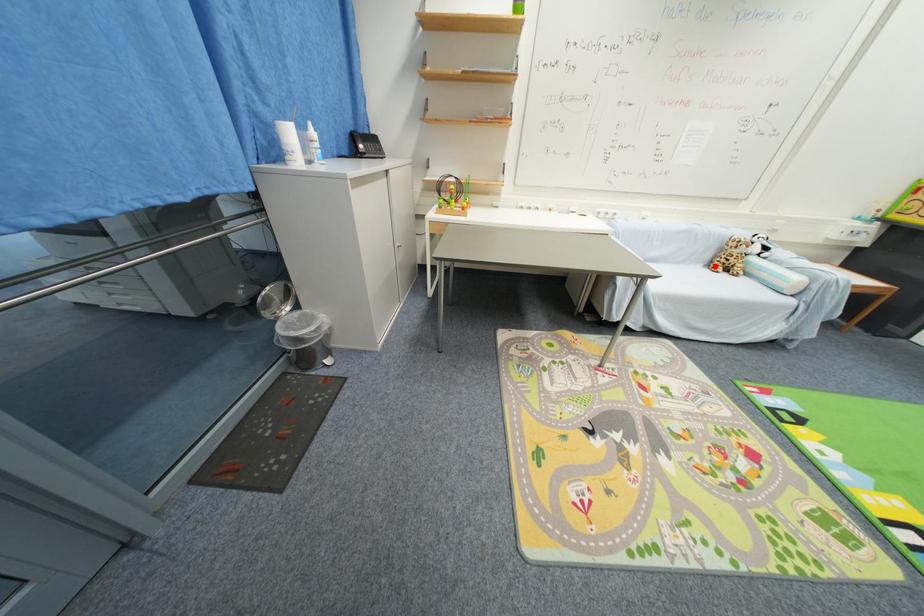
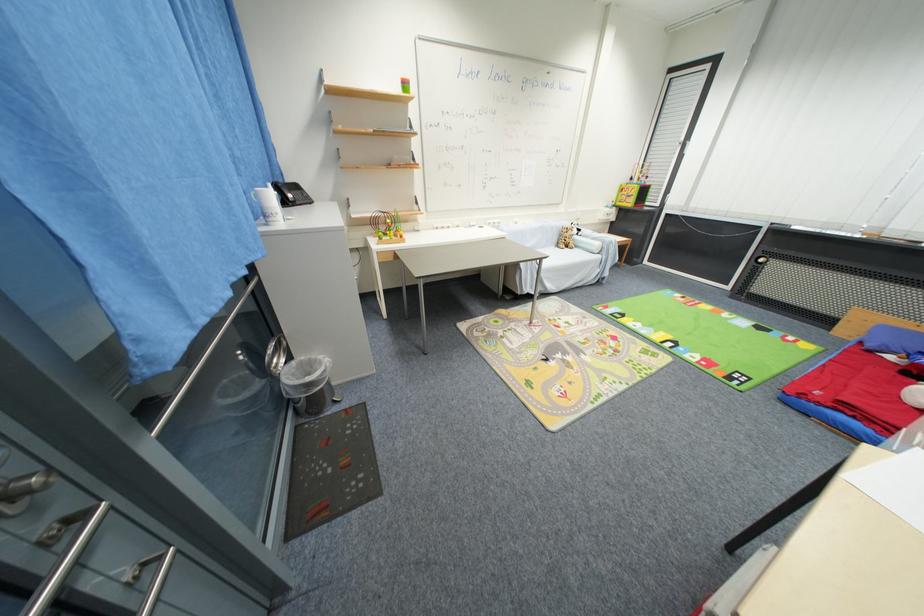
Where in the second image is the point corresponding to the highlighted location from the first image?

(563, 246)